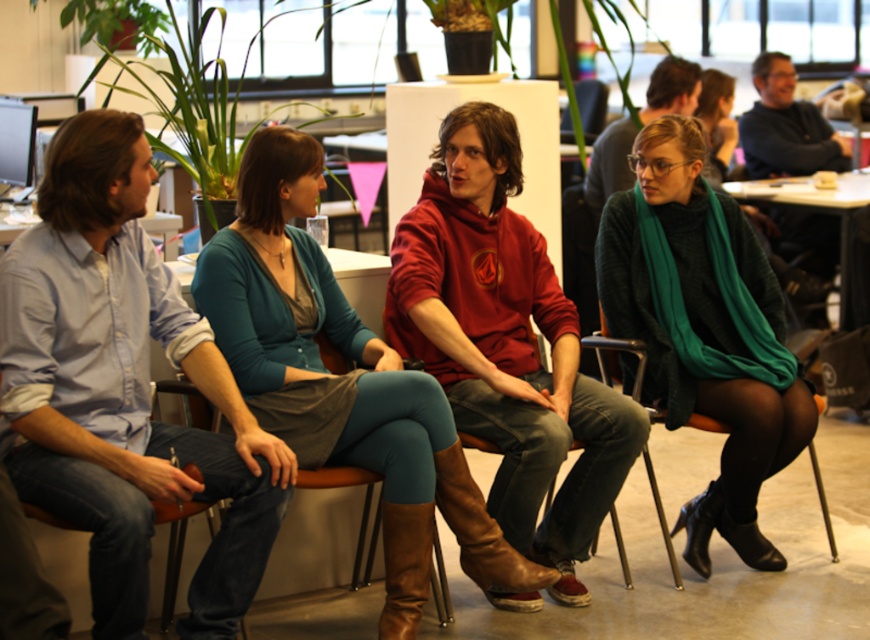
Question: Which object appears farthest from the camera in this image?

Choices:
 (A) brown leather boot at center
 (B) red hoodie at center
 (C) green knitted scarf at center
 (D) brown leather boot at lower center

Answer: (C)

Question: Which object appears farthest from the camera in this image?

Choices:
 (A) brown leather boot at lower center
 (B) teal fabric skirt at center

Answer: (B)

Question: Can you confirm if brown leather boot at center is positioned to the left of black leather boot at lower right?

Choices:
 (A) no
 (B) yes

Answer: (B)

Question: Is the position of red hoodie at center less distant than that of black leather boot at lower right?

Choices:
 (A) no
 (B) yes

Answer: (B)

Question: Does light blue shirt at left appear on the left side of teal fabric skirt at center?

Choices:
 (A) yes
 (B) no

Answer: (A)

Question: Which point is closer to the camera?

Choices:
 (A) green knitted scarf at center
 (B) brown leather boot at center
 (C) black leather boot at lower right
 (D) teal fabric skirt at center

Answer: (D)